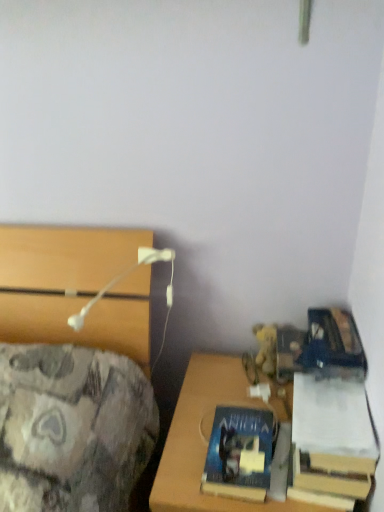
Identify the location of vacant area that lies between hardcover book at lower right, placed as the first book when sorted from right to left, and blue matte book at lower right, the 1th book when ordered from left to right. The width and height of the screenshot is (384, 512). (275, 440).